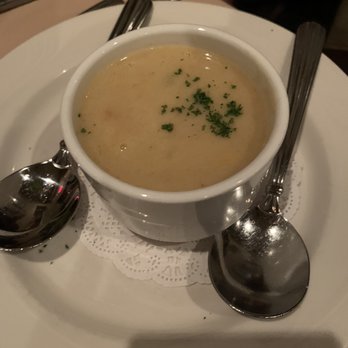
Locate an element on the screen. This screenshot has width=348, height=348. doily is located at coordinates (176, 257).